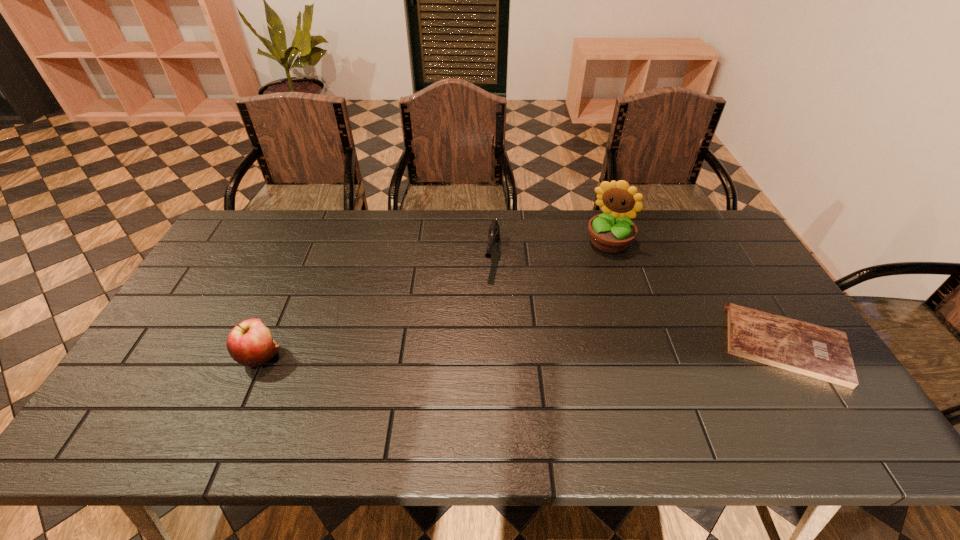
This screenshot has height=540, width=960. What are the coordinates of `the leftmost object` in the screenshot? It's located at (249, 343).

Locate an element on the screen. The width and height of the screenshot is (960, 540). the shortest object is located at coordinates (815, 351).

The height and width of the screenshot is (540, 960). In order to click on the rightmost object in this screenshot , I will do `click(815, 351)`.

You are a GUI agent. You are given a task and a screenshot of the screen. Output one action in this format:
    pyautogui.click(x=<x>, y=<y>)
    Task: Click on the sunflower
    The height and width of the screenshot is (540, 960).
    Given the screenshot: What is the action you would take?
    pyautogui.click(x=611, y=232)

This screenshot has width=960, height=540. Find the location of `the tallest object`. the tallest object is located at coordinates (611, 232).

I want to click on the third object from right to left, so click(494, 231).

At what (x,y) coordinates should I click in order to perform the action: click on vacant space located on the bitten side of the leftmost object. Please return your answer as a coordinate pair (x, y). Image resolution: width=960 pixels, height=540 pixels. Looking at the image, I should click on (309, 356).

This screenshot has width=960, height=540. In order to click on vacant space located 0.210m on the back of the Bible in this screenshot , I will do `click(732, 260)`.

The image size is (960, 540). In order to click on free space located on the face of the second object from right to left in this screenshot , I will do `click(587, 287)`.

At what (x,y) coordinates should I click in order to perform the action: click on vacant space situated on the face of the second object from right to left. Please return your answer as a coordinate pair (x, y). Looking at the image, I should click on (596, 269).